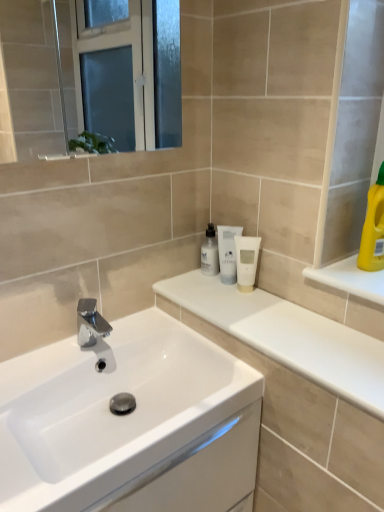
Question: From the image's perspective, relative to white glossy counter at center, is white glossy bottle at center, the 3th mouthwash positioned from the right, above or below?

Choices:
 (A) below
 (B) above

Answer: (B)

Question: From their relative heights in the image, would you say white glossy bottle at center, which is the first mouthwash from left to right, is taller or shorter than white glossy counter at center?

Choices:
 (A) short
 (B) tall

Answer: (B)

Question: Considering the real-world distances, which object is closest to the transparent plastic bottle at center, the second mouthwash from the right?

Choices:
 (A) white glossy counter at center
 (B) yellow plastic bottle at upper right
 (C) white glossy bottle at center, which is the first mouthwash from left to right
 (D) white matte tube at center, positioned as the third mouthwash in left-to-right order
 (E) white glossy sink at center

Answer: (D)

Question: Which object is positioned closest to the white glossy counter at center?

Choices:
 (A) white glossy sink at center
 (B) transparent plastic bottle at center, marked as the second mouthwash in a left-to-right arrangement
 (C) chrome/metallic faucet at center
 (D) yellow plastic bottle at upper right
 (E) white glossy bottle at center, which is the first mouthwash from left to right

Answer: (A)